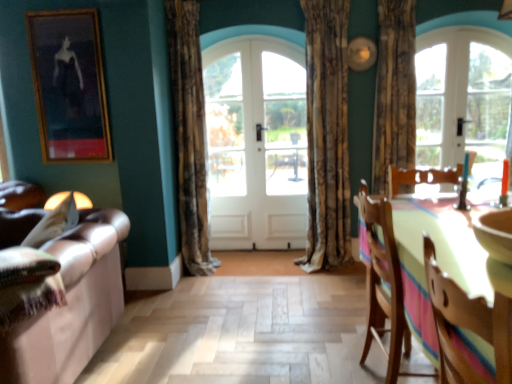
Question: Are wooden chair at right, which is the 2th chair from front to back, and white glass door at center, acting as the first screen door starting from the right, located far from each other?

Choices:
 (A) yes
 (B) no

Answer: (A)

Question: Would you say white glass door at center, arranged as the second screen door when viewed from the left, is part of wooden chair at right, acting as the first chair starting from the back,'s contents?

Choices:
 (A) no
 (B) yes

Answer: (A)

Question: From a real-world perspective, is wooden chair at right, acting as the first chair starting from the back, on white glass door at center, acting as the first screen door starting from the right?

Choices:
 (A) yes
 (B) no

Answer: (B)

Question: Is wooden chair at right, acting as the first chair starting from the back, looking in the opposite direction of white glass door at center, acting as the first screen door starting from the right?

Choices:
 (A) yes
 (B) no

Answer: (B)

Question: Considering the relative positions of wooden chair at right, which is the 2th chair from front to back, and white glass door at center, arranged as the second screen door when viewed from the left, in the image provided, is wooden chair at right, which is the 2th chair from front to back, to the left of white glass door at center, arranged as the second screen door when viewed from the left, from the viewer's perspective?

Choices:
 (A) yes
 (B) no

Answer: (B)

Question: From the image's perspective, is wooden framed painting at upper left positioned above or below leather couch at left?

Choices:
 (A) above
 (B) below

Answer: (A)

Question: Considering their positions, is wooden framed painting at upper left located in front of or behind leather couch at left?

Choices:
 (A) front
 (B) behind

Answer: (B)

Question: From a real-world perspective, is wooden framed painting at upper left above or below leather couch at left?

Choices:
 (A) below
 (B) above

Answer: (B)

Question: Choose the correct answer: Is wooden framed painting at upper left inside leather couch at left or outside it?

Choices:
 (A) inside
 (B) outside

Answer: (B)

Question: Looking at their shapes, would you say white glass door at center, arranged as the second screen door when viewed from the left, is wider or thinner than white wooden door at center?

Choices:
 (A) wide
 (B) thin

Answer: (A)

Question: Considering the positions of point (265, 107) and point (218, 162), is point (265, 107) closer or farther from the camera than point (218, 162)?

Choices:
 (A) closer
 (B) farther

Answer: (A)

Question: Based on their positions, is white glass door at center, acting as the first screen door starting from the right, located to the left or right of white wooden door at center?

Choices:
 (A) right
 (B) left

Answer: (A)

Question: From a real-world perspective, is white glass door at center, arranged as the second screen door when viewed from the left, physically located above or below white wooden door at center?

Choices:
 (A) above
 (B) below

Answer: (B)

Question: Is white glossy door at center, the 2th screen door when ordered from right to left, taller or shorter than brown textured curtain at center, acting as the third curtain starting from the right?

Choices:
 (A) short
 (B) tall

Answer: (A)

Question: From the image's perspective, is white glossy door at center, which is counted as the 1th screen door, starting from the left, located above or below brown textured curtain at center, the first curtain in the left-to-right sequence?

Choices:
 (A) below
 (B) above

Answer: (A)